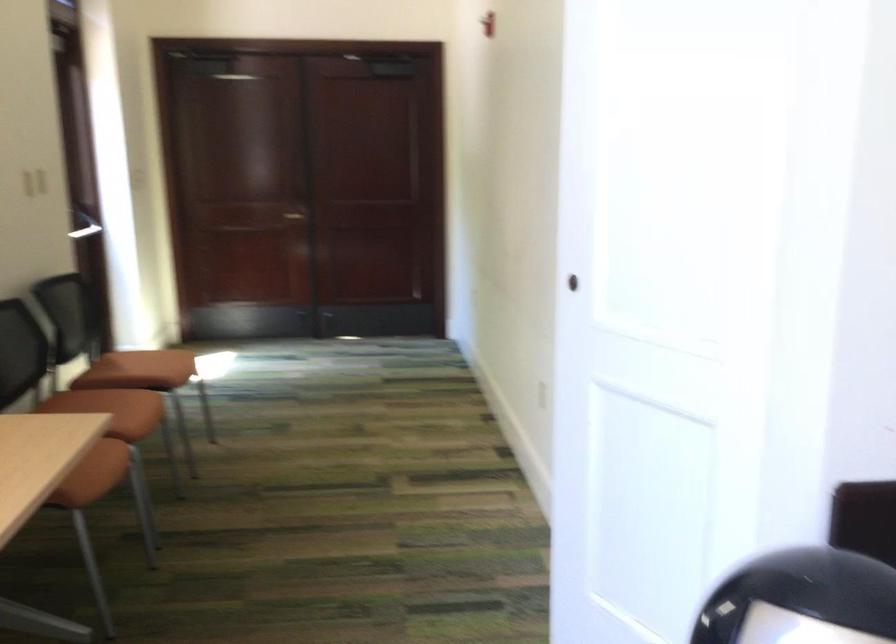
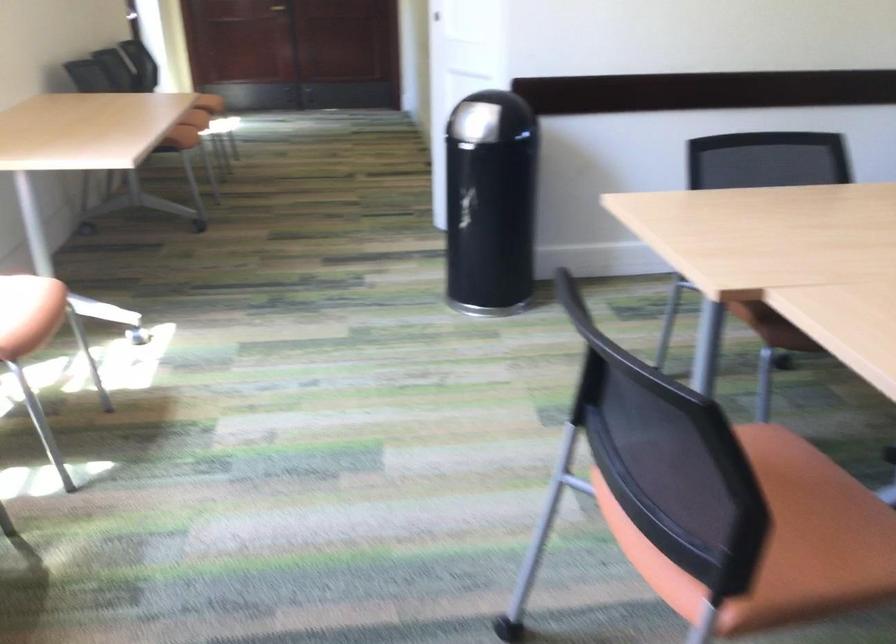
In the second image, find the point that corresponds to pixel 125 460 in the first image.

(192, 124)